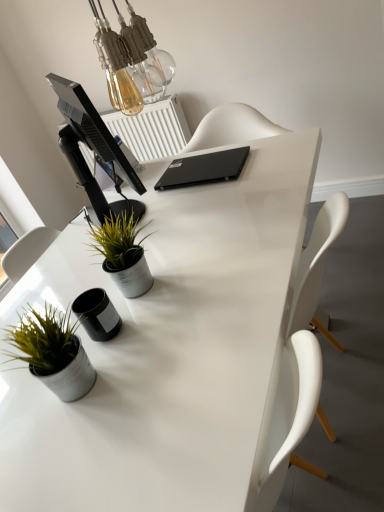
Where is `vacant space to the right of matte gray pot at lower left, which is the 2th houseplant from top to bottom`? vacant space to the right of matte gray pot at lower left, which is the 2th houseplant from top to bottom is located at coordinates (146, 354).